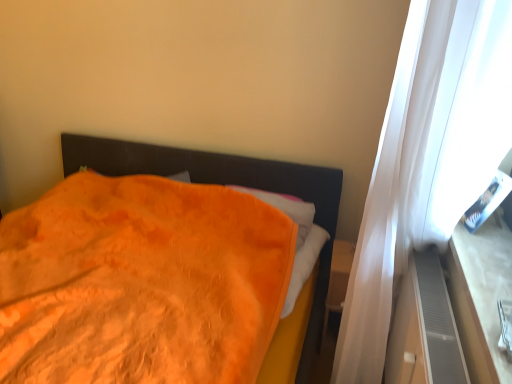
Question: Is wooden at right located within gray textured dresser at right?

Choices:
 (A) no
 (B) yes

Answer: (A)

Question: Considering the relative sizes of gray textured dresser at right and wooden at right in the image provided, is gray textured dresser at right shorter than wooden at right?

Choices:
 (A) no
 (B) yes

Answer: (A)

Question: From the image's perspective, is gray textured dresser at right located beneath wooden at right?

Choices:
 (A) no
 (B) yes

Answer: (B)

Question: Does gray textured dresser at right appear on the right side of wooden at right?

Choices:
 (A) no
 (B) yes

Answer: (A)

Question: Considering the relative sizes of gray textured dresser at right and wooden at right in the image provided, is gray textured dresser at right smaller than wooden at right?

Choices:
 (A) yes
 (B) no

Answer: (B)

Question: Looking at their shapes, would you say wooden at right is wider or thinner than gray textured dresser at right?

Choices:
 (A) wide
 (B) thin

Answer: (A)

Question: Based on their positions, is wooden at right located to the left or right of gray textured dresser at right?

Choices:
 (A) left
 (B) right

Answer: (B)

Question: Is wooden at right taller or shorter than gray textured dresser at right?

Choices:
 (A) short
 (B) tall

Answer: (A)

Question: Do you think wooden at right is within gray textured dresser at right, or outside of it?

Choices:
 (A) inside
 (B) outside

Answer: (B)

Question: Is wooden at right taller or shorter than orange soft blanket at left?

Choices:
 (A) tall
 (B) short

Answer: (B)

Question: Based on their sizes in the image, would you say wooden at right is bigger or smaller than orange soft blanket at left?

Choices:
 (A) small
 (B) big

Answer: (A)

Question: In the image, is wooden at right on the left side or the right side of orange soft blanket at left?

Choices:
 (A) left
 (B) right

Answer: (B)

Question: From a real-world perspective, is wooden at right positioned above or below orange soft blanket at left?

Choices:
 (A) below
 (B) above

Answer: (B)

Question: From the image's perspective, is orange soft blanket at left above or below gray textured dresser at right?

Choices:
 (A) below
 (B) above

Answer: (B)

Question: Considering the positions of orange soft blanket at left and gray textured dresser at right in the image, is orange soft blanket at left wider or thinner than gray textured dresser at right?

Choices:
 (A) wide
 (B) thin

Answer: (A)